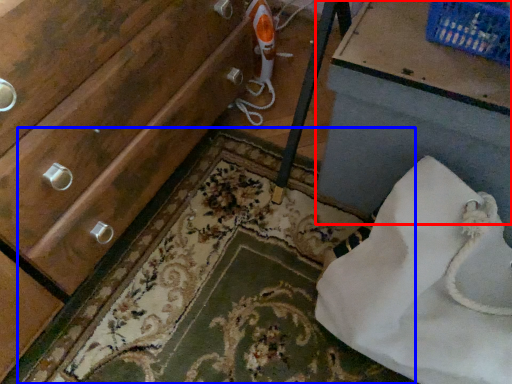
Question: Which of the following is the closest to the observer, vanity (highlighted by a red box) or bath mat (highlighted by a blue box)?

Choices:
 (A) vanity
 (B) bath mat

Answer: (A)